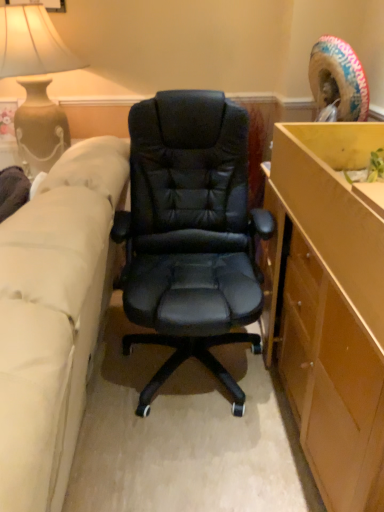
Question: Is the depth of matte beige vase at upper left less than that of beige fabric couch at left?

Choices:
 (A) yes
 (B) no

Answer: (B)

Question: Considering the relative sizes of matte beige vase at upper left and beige fabric couch at left in the image provided, is matte beige vase at upper left bigger than beige fabric couch at left?

Choices:
 (A) yes
 (B) no

Answer: (B)

Question: Does matte beige vase at upper left have a greater width compared to beige fabric couch at left?

Choices:
 (A) yes
 (B) no

Answer: (B)

Question: Does matte beige vase at upper left have a lesser height compared to beige fabric couch at left?

Choices:
 (A) yes
 (B) no

Answer: (A)

Question: Is beige fabric couch at left at the back of matte beige vase at upper left?

Choices:
 (A) yes
 (B) no

Answer: (B)

Question: Is matte beige vase at upper left outside of beige fabric couch at left?

Choices:
 (A) no
 (B) yes

Answer: (B)

Question: Is beige fabric couch at left positioned before matte beige vase at upper left?

Choices:
 (A) no
 (B) yes

Answer: (B)

Question: Would you say beige fabric couch at left contains matte beige vase at upper left?

Choices:
 (A) yes
 (B) no

Answer: (B)

Question: From the image's perspective, is beige fabric couch at left on matte beige vase at upper left?

Choices:
 (A) no
 (B) yes

Answer: (A)

Question: Is beige fabric couch at left taller than matte beige vase at upper left?

Choices:
 (A) yes
 (B) no

Answer: (A)

Question: Does beige fabric couch at left come behind matte beige vase at upper left?

Choices:
 (A) no
 (B) yes

Answer: (A)

Question: Can you confirm if beige fabric couch at left is shorter than matte beige vase at upper left?

Choices:
 (A) no
 (B) yes

Answer: (A)

Question: Would you say beige fabric couch at left is inside or outside matte beige vase at upper left?

Choices:
 (A) inside
 (B) outside

Answer: (B)